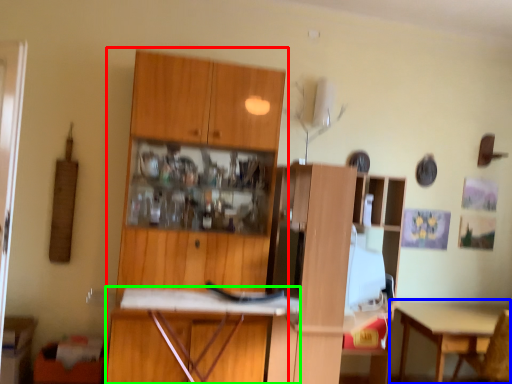
Question: Considering the real-world distances, which object is farthest from cabinetry (highlighted by a red box)? table (highlighted by a blue box) or desk (highlighted by a green box)?

Choices:
 (A) table
 (B) desk

Answer: (A)